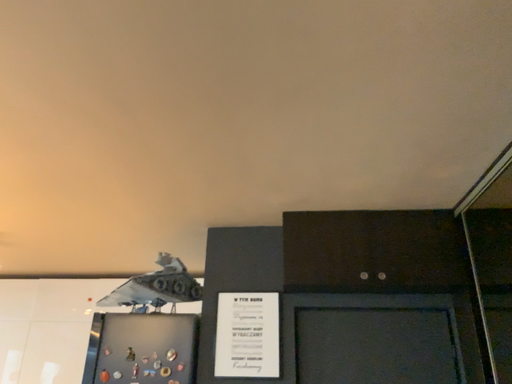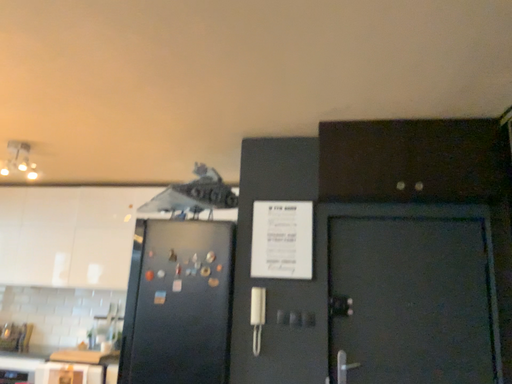
Question: How did the camera likely rotate when shooting the video?

Choices:
 (A) rotated downward
 (B) rotated upward

Answer: (A)